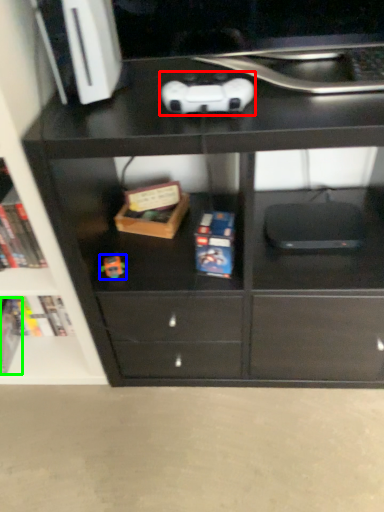
Question: Which object is positioned closest to game controller (highlighted by a red box)? Select from toy (highlighted by a blue box) and paperback book (highlighted by a green box).

Choices:
 (A) toy
 (B) paperback book

Answer: (A)